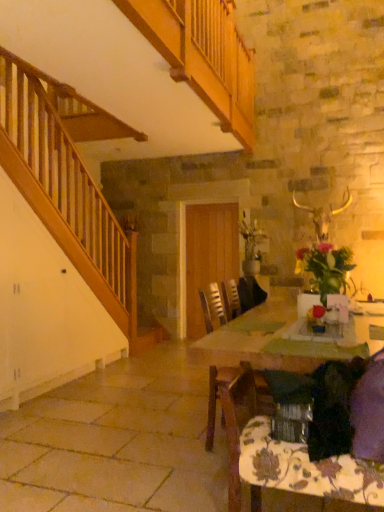
Question: Is wooden table at center at the right side of wooden chair at center?

Choices:
 (A) no
 (B) yes

Answer: (B)

Question: Is wooden table at center shorter than wooden chair at center?

Choices:
 (A) yes
 (B) no

Answer: (A)

Question: From a real-world perspective, is wooden table at center physically above wooden chair at center?

Choices:
 (A) yes
 (B) no

Answer: (B)

Question: Is wooden table at center positioned far away from wooden chair at center?

Choices:
 (A) no
 (B) yes

Answer: (A)

Question: Is wooden table at center further to camera compared to wooden chair at center?

Choices:
 (A) no
 (B) yes

Answer: (A)

Question: Does point (231, 287) appear closer or farther from the camera than point (218, 342)?

Choices:
 (A) farther
 (B) closer

Answer: (A)

Question: From a real-world perspective, is wooden chair at center above or below wooden table at center?

Choices:
 (A) below
 (B) above

Answer: (B)

Question: In the image, is wooden chair at center positioned in front of or behind wooden table at center?

Choices:
 (A) front
 (B) behind

Answer: (B)

Question: From the image's perspective, is wooden chair at center above or below wooden table at center?

Choices:
 (A) below
 (B) above

Answer: (B)

Question: Would you say floral-patterned fabric at lower right is inside or outside wooden table at center?

Choices:
 (A) inside
 (B) outside

Answer: (B)

Question: Considering the relative positions of floral-patterned fabric at lower right and wooden table at center in the image provided, is floral-patterned fabric at lower right to the left or to the right of wooden table at center?

Choices:
 (A) left
 (B) right

Answer: (A)

Question: From the image's perspective, relative to wooden table at center, is floral-patterned fabric at lower right above or below?

Choices:
 (A) above
 (B) below

Answer: (B)

Question: In the image, is floral-patterned fabric at lower right positioned in front of or behind wooden table at center?

Choices:
 (A) behind
 (B) front

Answer: (B)

Question: From the image's perspective, is wooden chair at center above or below floral-patterned fabric at lower right?

Choices:
 (A) above
 (B) below

Answer: (A)

Question: Is point (208, 430) positioned closer to the camera than point (243, 479)?

Choices:
 (A) closer
 (B) farther

Answer: (B)